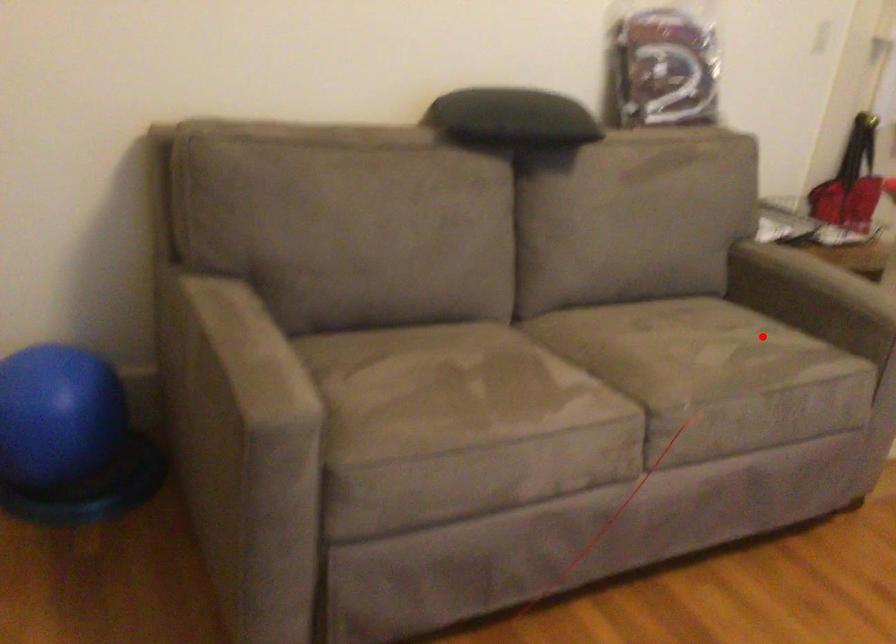
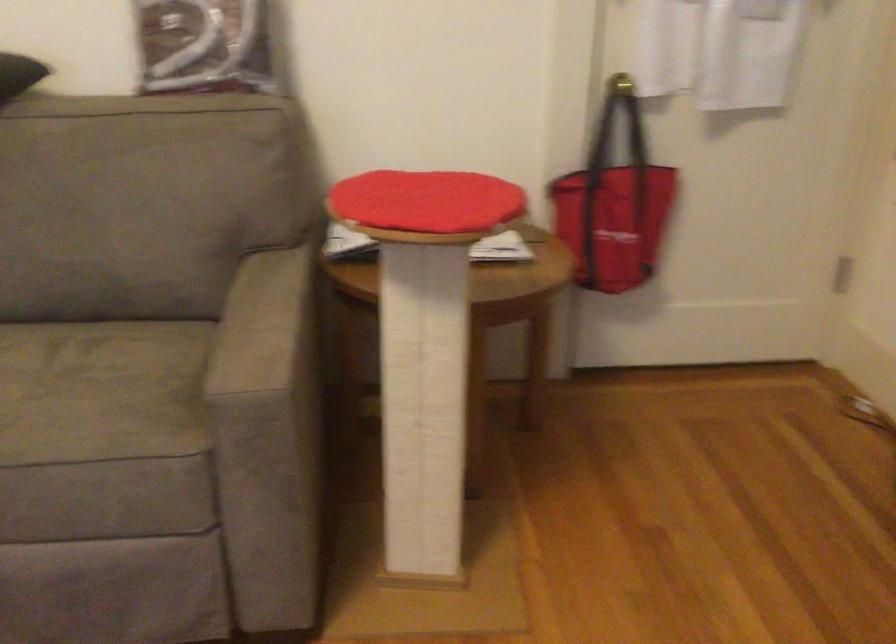
Question: A red point is marked in image1. In image2, is the corresponding 3D point closer to the camera or farther? Reply with the corresponding letter.

Choices:
 (A) The corresponding 3D point is closer.
 (B) The corresponding 3D point is farther.

Answer: (A)